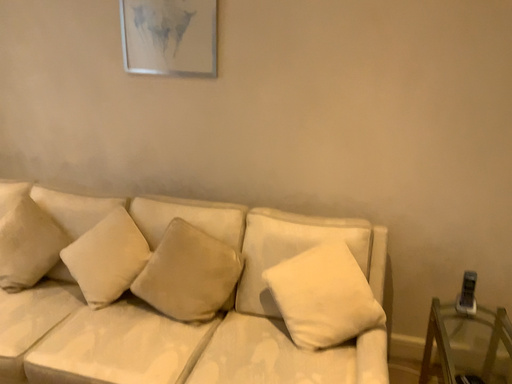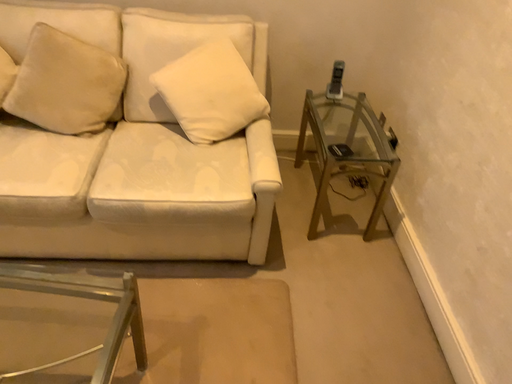
Question: How did the camera likely rotate when shooting the video?

Choices:
 (A) rotated downward
 (B) rotated upward

Answer: (A)